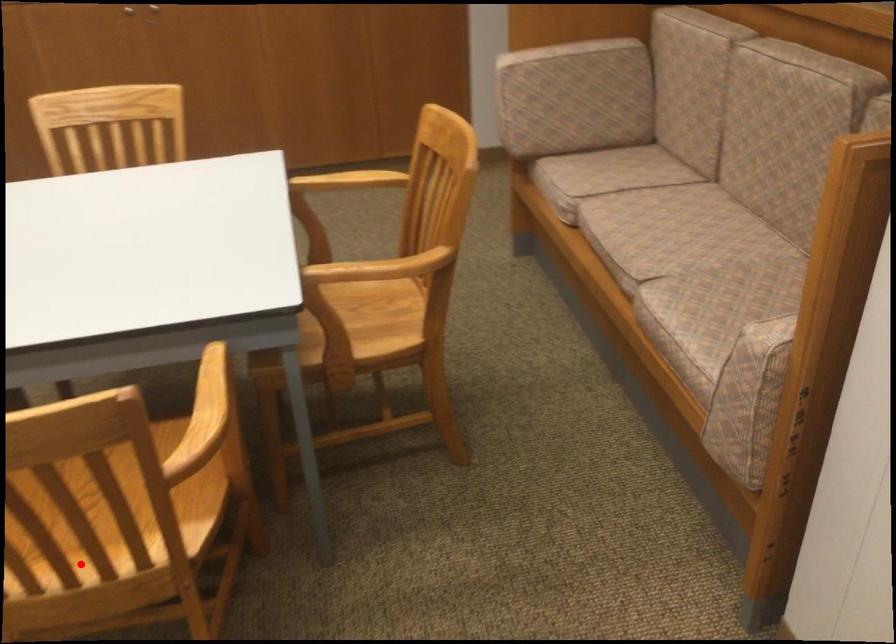
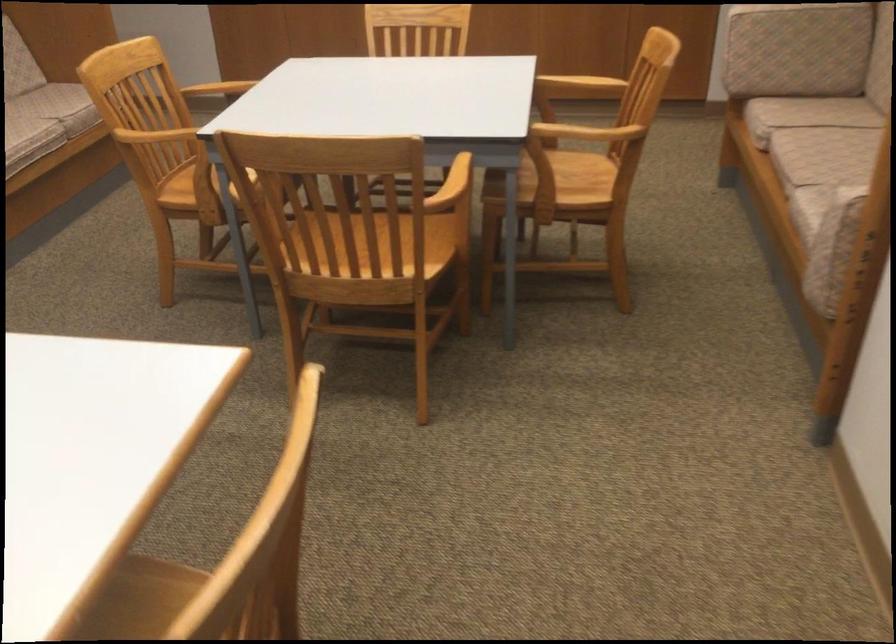
The point at the highlighted location is marked in the first image. Where is the corresponding point in the second image?

(358, 259)